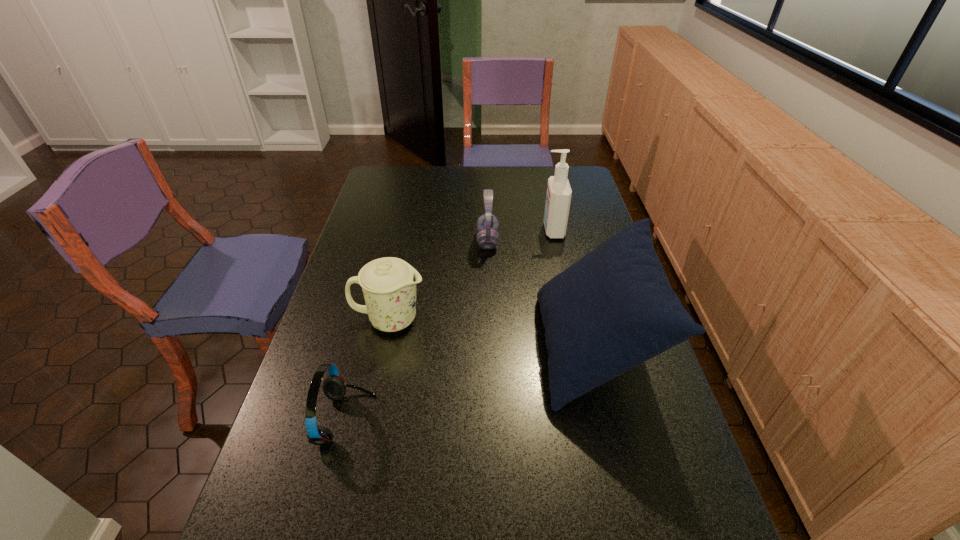
Where is `blank space located on the facing side of the cushion`? Image resolution: width=960 pixels, height=540 pixels. blank space located on the facing side of the cushion is located at coordinates (409, 348).

This screenshot has width=960, height=540. Find the location of `vacant space located on the facing side of the cushion`. vacant space located on the facing side of the cushion is located at coordinates (456, 348).

This screenshot has height=540, width=960. What are the coordinates of `vacant area located 0.100m on the facing side of the cushion` in the screenshot? It's located at (504, 348).

Image resolution: width=960 pixels, height=540 pixels. Identify the location of vacant area located 0.340m on the spout of the chinaware. (543, 320).

Locate an element on the screen. The width and height of the screenshot is (960, 540). vacant point located 0.330m on the headband and ear cups of the taller headset is located at coordinates (384, 240).

The image size is (960, 540). In order to click on vacant space situated on the headband and ear cups of the taller headset in this screenshot , I will do `click(418, 240)`.

You are a GUI agent. You are given a task and a screenshot of the screen. Output one action in this format:
    pyautogui.click(x=<x>, y=<y>)
    Task: Click on the blank area located 0.050m on the headband and ear cups of the taller headset
    The width and height of the screenshot is (960, 540).
    Given the screenshot: What is the action you would take?
    pyautogui.click(x=463, y=240)

Where is `free point located with the microphone attached to the side of the shorter headset`? free point located with the microphone attached to the side of the shorter headset is located at coordinates (509, 420).

The image size is (960, 540). What are the coordinates of `chinaware positioned at the left edge` in the screenshot? It's located at (389, 284).

I want to click on headset located at the left edge, so click(334, 387).